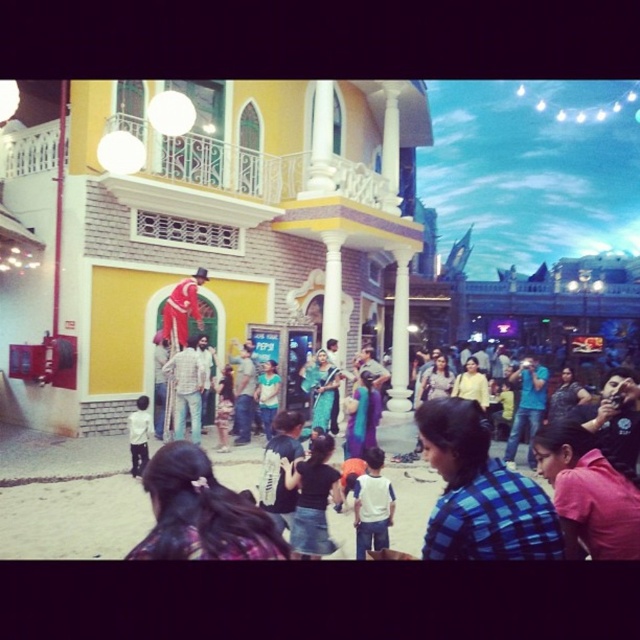
At what (x,y) coordinates should I click in order to perform the action: click on blue plaid shirt at lower right. Please return your answer as a coordinate pair (x, y). The width and height of the screenshot is (640, 640). Looking at the image, I should click on (588, 493).

Between blue plaid shirt at lower right and light brown cotton shirt at center, which one appears on the left side from the viewer's perspective?

From the viewer's perspective, light brown cotton shirt at center appears more on the left side.

The width and height of the screenshot is (640, 640). Identify the location of blue plaid shirt at lower right. (588, 493).

The height and width of the screenshot is (640, 640). I want to click on blue plaid shirt at lower right, so click(x=588, y=493).

How far apart are blue checkered shirt at center and silk blue saree at center?

The distance of blue checkered shirt at center from silk blue saree at center is 87.53 feet.

Is point (449, 486) positioned before point (316, 388)?

Yes, point (449, 486) is closer to viewer.

Describe the element at coordinates (481, 492) in the screenshot. I see `blue checkered shirt at center` at that location.

The image size is (640, 640). In order to click on blue checkered shirt at center in this screenshot , I will do `click(481, 492)`.

Between yellow matte building at center and silk blue saree at center, which one appears on the left side from the viewer's perspective?

yellow matte building at center is more to the left.

Which of these two, yellow matte building at center or silk blue saree at center, stands taller?

yellow matte building at center is taller.

Which is behind, point (332, 88) or point (332, 403)?

The point (332, 88) is behind.

You are a GUI agent. You are given a task and a screenshot of the screen. Output one action in this format:
    pyautogui.click(x=<x>, y=<y>)
    Task: Click on the yellow matte building at center
    This screenshot has height=640, width=640.
    Given the screenshot: What is the action you would take?
    pyautogui.click(x=209, y=227)